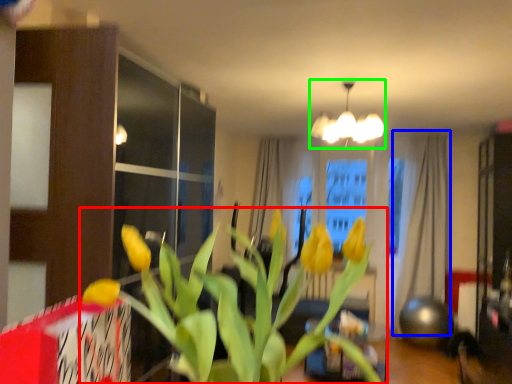
Question: Based on their relative distances, which object is nearer to houseplant (highlighted by a red box)? Choose from curtain (highlighted by a blue box) and lamp (highlighted by a green box).

Choices:
 (A) curtain
 (B) lamp

Answer: (B)